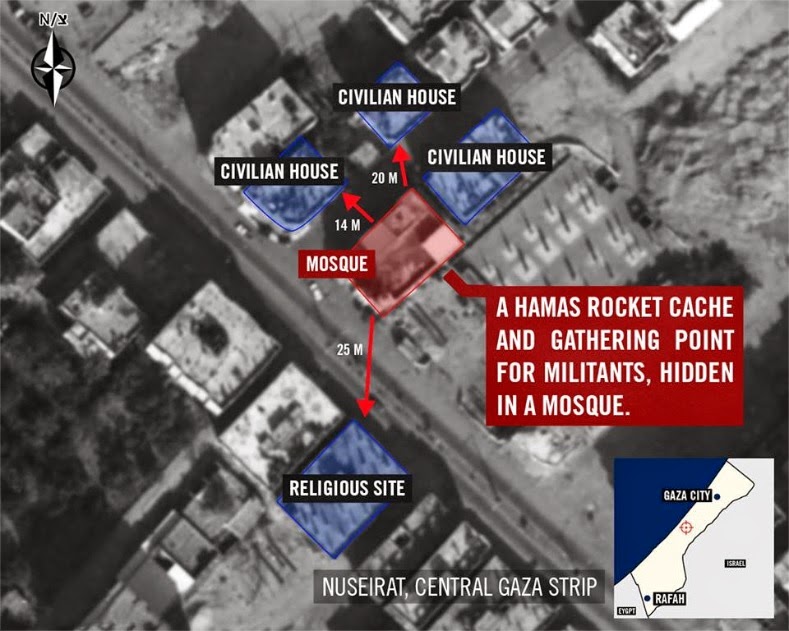
Locate an element on the screen. The height and width of the screenshot is (631, 789). civilian house is located at coordinates (249, 173), (293, 166), (434, 154), (502, 156), (343, 96), (409, 98).